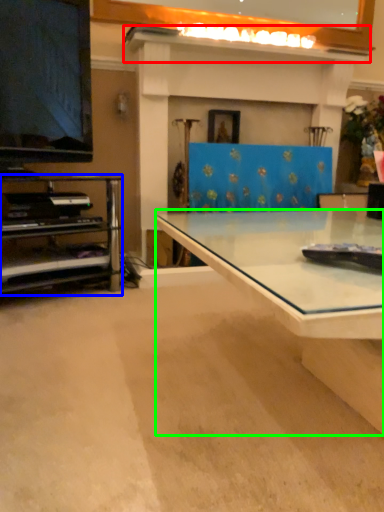
Question: Which object is positioned farthest from mantle (highlighted by a red box)? Select from shelf (highlighted by a blue box) and desk (highlighted by a green box).

Choices:
 (A) shelf
 (B) desk

Answer: (B)